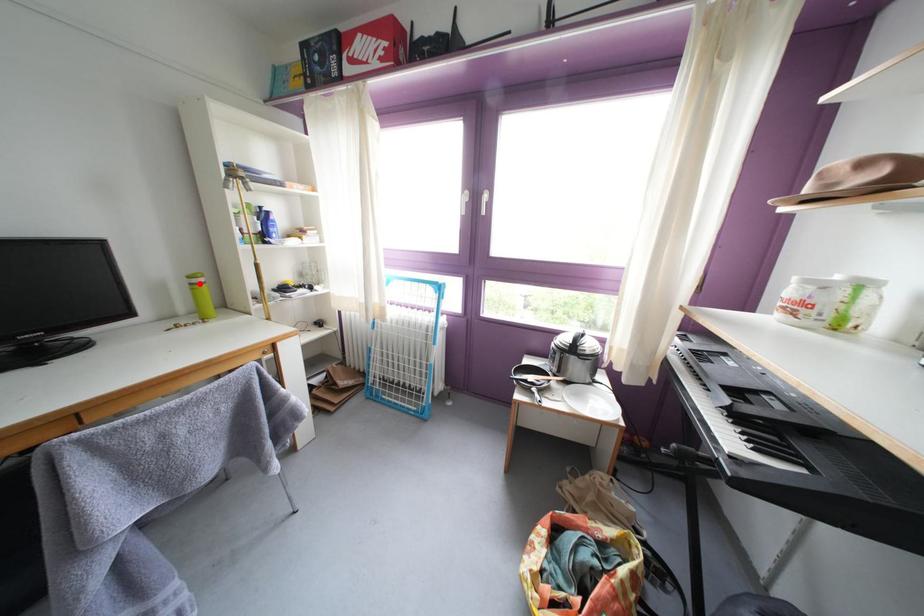
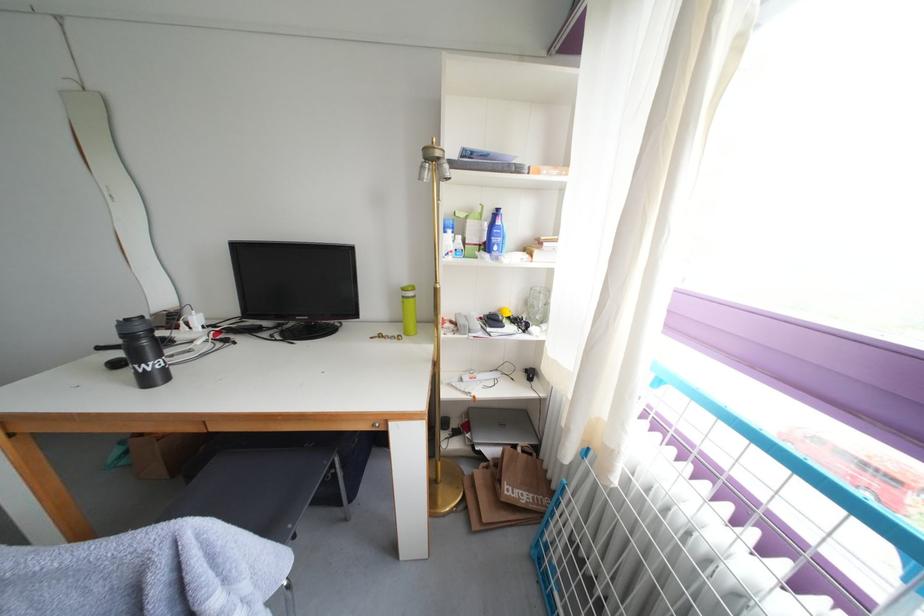
Question: I am providing you with two images of the same scene from different viewpoints. A red point is marked on the first image. Is the red point's position out of view in image 2?

Choices:
 (A) Yes
 (B) No

Answer: (B)